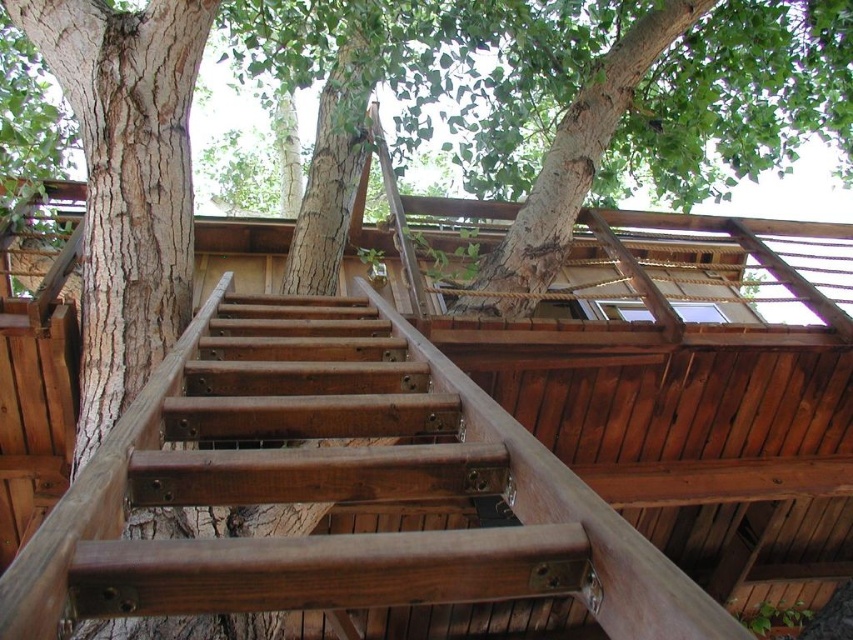
You are a child trying to reach the treehouse. You see the brown wooden stairs at center and the wooden ladder at center. Which one should you use to safely climb up?

The brown wooden stairs at center is positioned under the wooden ladder at center, so you should use the brown wooden stairs at center to safely climb up since stairs are easier to navigate for a child.

You are a parent trying to decide which structure to use to reach the treehouse. You have a child who is 4 feet tall. Which structure would be safer for your child to climb? Please consider the size difference between the brown wooden stairs at center and the wooden ladder at center.

The brown wooden stairs at center would be safer for your child to climb because they are larger in size compared to the wooden ladder at center, providing more stable steps.